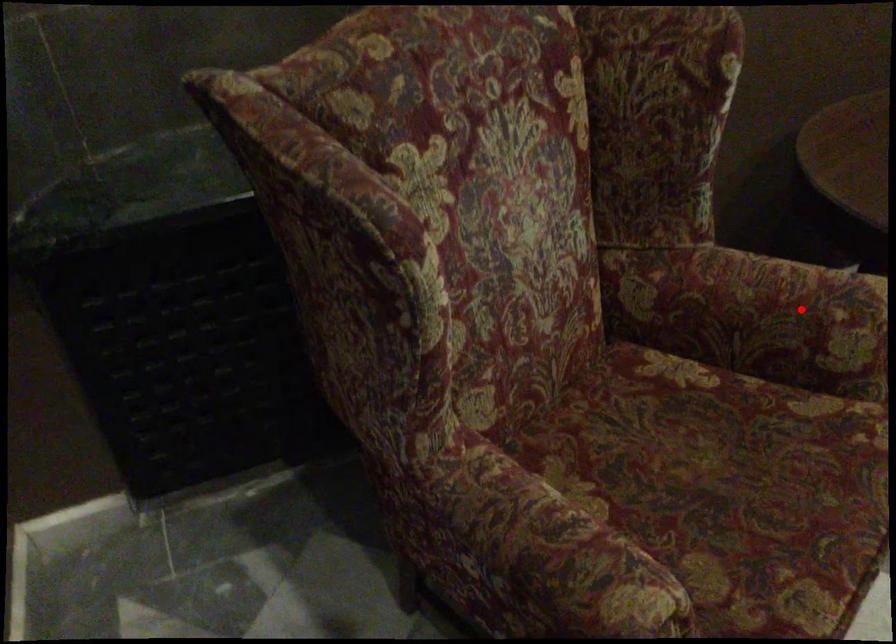
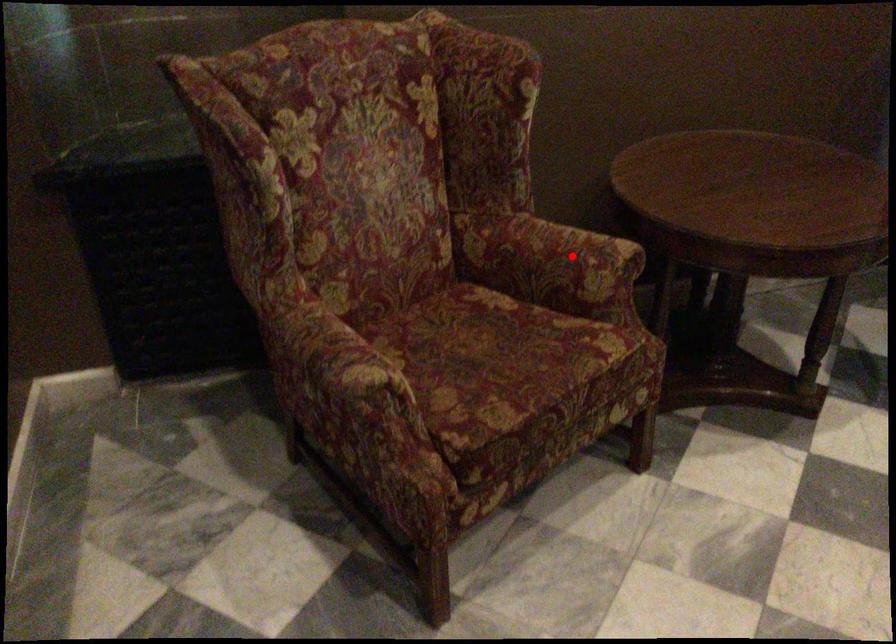
Based on the photo, I am providing you with two images of the same scene from different viewpoints. A red point is marked on the first image and another point is marked on the second image. Are the points marked in image1 and image2 representing the same 3D position?

Yes